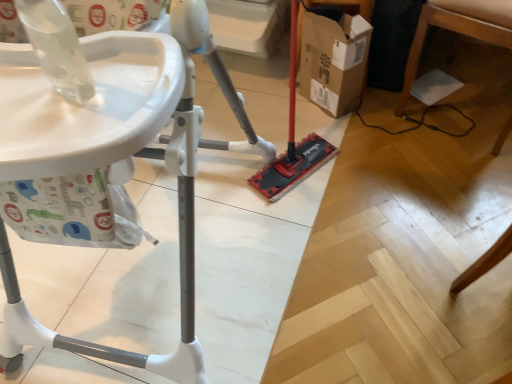
Where is `white plastic high chair at left, the second furniture positioned from the right`? white plastic high chair at left, the second furniture positioned from the right is located at coordinates (129, 167).

This screenshot has height=384, width=512. Identify the location of white plastic high chair at left, which appears as the 1th furniture when viewed from the left. (129, 167).

Could you measure the distance between white plastic high chair at left, the second furniture positioned from the right, and cardboard box at center?

white plastic high chair at left, the second furniture positioned from the right, is 27.99 inches away from cardboard box at center.

Between white plastic high chair at left, which appears as the 1th furniture when viewed from the left, and cardboard box at center, which one appears on the right side from the viewer's perspective?

cardboard box at center is more to the right.

From the image's perspective, between white plastic high chair at left, the second furniture positioned from the right, and cardboard box at center, which one is located above?

cardboard box at center is shown above in the image.

Are white plastic high chair at left, the second furniture positioned from the right, and cardboard box at center far apart?

white plastic high chair at left, the second furniture positioned from the right, is near cardboard box at center, not far away.

Where is `furniture that is the 2nd object located in front of the cardboard box at center`? This screenshot has height=384, width=512. furniture that is the 2nd object located in front of the cardboard box at center is located at coordinates (129, 167).

Can you tell me how much cardboard box at center and white plastic high chair at left, the second furniture positioned from the right, differ in facing direction?

They differ by 0.279 degrees in their facing directions.

Is cardboard box at center bigger than white plastic high chair at left, the second furniture positioned from the right?

Incorrect, cardboard box at center is not larger than white plastic high chair at left, the second furniture positioned from the right.

Is cardboard box at center closer to camera compared to white plastic high chair at left, which appears as the 1th furniture when viewed from the left?

No, cardboard box at center is further to the viewer.

Are wooden table leg at lower right, which is counted as the 2th furniture, starting from the left, and white plastic high chair at left, which appears as the 1th furniture when viewed from the left, located far from each other?

Indeed, wooden table leg at lower right, which is counted as the 2th furniture, starting from the left, is not near white plastic high chair at left, which appears as the 1th furniture when viewed from the left.

Is point (467, 16) closer to camera compared to point (24, 48)?

No, it is not.

Is wooden table leg at lower right, the 1th furniture positioned from the right, closer to the viewer compared to white plastic high chair at left, which appears as the 1th furniture when viewed from the left?

No, it is behind white plastic high chair at left, which appears as the 1th furniture when viewed from the left.

Consider the image. Which object is further away from the camera taking this photo, cardboard box at center or wooden table leg at lower right, which is counted as the 2th furniture, starting from the left?

Positioned behind is cardboard box at center.

Is cardboard box at center taller or shorter than wooden table leg at lower right, which is counted as the 2th furniture, starting from the left?

Considering their sizes, cardboard box at center has less height than wooden table leg at lower right, which is counted as the 2th furniture, starting from the left.

Is cardboard box at center facing away from wooden table leg at lower right, which is counted as the 2th furniture, starting from the left?

No, cardboard box at center is not facing away from wooden table leg at lower right, which is counted as the 2th furniture, starting from the left.

Identify the location of cardboard box located below the wooden table leg at lower right, the 1th furniture positioned from the right (from the image's perspective). Image resolution: width=512 pixels, height=384 pixels. (332, 59).

Is wooden table leg at lower right, which is counted as the 2th furniture, starting from the left, far from cardboard box at center?

No, there isn't a large distance between wooden table leg at lower right, which is counted as the 2th furniture, starting from the left, and cardboard box at center.

Considering the sizes of objects wooden table leg at lower right, which is counted as the 2th furniture, starting from the left, and cardboard box at center in the image provided, who is thinner, wooden table leg at lower right, which is counted as the 2th furniture, starting from the left, or cardboard box at center?

Thinner between the two is cardboard box at center.

Which object is positioned more to the right, wooden table leg at lower right, which is counted as the 2th furniture, starting from the left, or cardboard box at center?

wooden table leg at lower right, which is counted as the 2th furniture, starting from the left, is more to the right.

Looking at this image, is white plastic high chair at left, which appears as the 1th furniture when viewed from the left, surrounding wooden table leg at lower right, the 1th furniture positioned from the right?

No, wooden table leg at lower right, the 1th furniture positioned from the right, is located outside of white plastic high chair at left, which appears as the 1th furniture when viewed from the left.

Does white plastic high chair at left, the second furniture positioned from the right, have a larger size compared to wooden table leg at lower right, the 1th furniture positioned from the right?

Correct, white plastic high chair at left, the second furniture positioned from the right, is larger in size than wooden table leg at lower right, the 1th furniture positioned from the right.

From the image's perspective, would you say white plastic high chair at left, which appears as the 1th furniture when viewed from the left, is positioned over wooden table leg at lower right, which is counted as the 2th furniture, starting from the left?

No, from the image's perspective, white plastic high chair at left, which appears as the 1th furniture when viewed from the left, is not over wooden table leg at lower right, which is counted as the 2th furniture, starting from the left.

What's the angular difference between white plastic high chair at left, which appears as the 1th furniture when viewed from the left, and wooden table leg at lower right, which is counted as the 2th furniture, starting from the left,'s facing directions?

The angle between the facing direction of white plastic high chair at left, which appears as the 1th furniture when viewed from the left, and the facing direction of wooden table leg at lower right, which is counted as the 2th furniture, starting from the left, is 0.141 degrees.

Find the location of a particular element. cardboard box that appears below the white plastic high chair at left, the second furniture positioned from the right (from a real-world perspective) is located at coordinates (332, 59).

Find the location of a particular element. Image resolution: width=512 pixels, height=384 pixels. the 2nd furniture in front of the cardboard box at center is located at coordinates (129, 167).

When comparing their distances from cardboard box at center, does wooden table leg at lower right, which is counted as the 2th furniture, starting from the left, or white plastic high chair at left, the second furniture positioned from the right, seem closer?

Based on the image, wooden table leg at lower right, which is counted as the 2th furniture, starting from the left, appears to be nearer to cardboard box at center.

Estimate the real-world distances between objects in this image. Which object is further from white plastic high chair at left, the second furniture positioned from the right, wooden table leg at lower right, which is counted as the 2th furniture, starting from the left, or cardboard box at center?

wooden table leg at lower right, which is counted as the 2th furniture, starting from the left, lies further to white plastic high chair at left, the second furniture positioned from the right, than the other object.

Considering their positions, is white plastic high chair at left, which appears as the 1th furniture when viewed from the left, positioned closer to cardboard box at center than wooden table leg at lower right, the 1th furniture positioned from the right?

The object closer to cardboard box at center is wooden table leg at lower right, the 1th furniture positioned from the right.

From the image, which object appears to be farther from wooden table leg at lower right, the 1th furniture positioned from the right, cardboard box at center or white plastic high chair at left, the second furniture positioned from the right?

Based on the image, white plastic high chair at left, the second furniture positioned from the right, appears to be further to wooden table leg at lower right, the 1th furniture positioned from the right.

Looking at the image, which one is located further to white plastic high chair at left, the second furniture positioned from the right, cardboard box at center or wooden table leg at lower right, which is counted as the 2th furniture, starting from the left?

wooden table leg at lower right, which is counted as the 2th furniture, starting from the left, is positioned further to the anchor white plastic high chair at left, the second furniture positioned from the right.

Based on their spatial positions, is white plastic high chair at left, which appears as the 1th furniture when viewed from the left, or cardboard box at center closer to wooden table leg at lower right, the 1th furniture positioned from the right?

cardboard box at center is closer to wooden table leg at lower right, the 1th furniture positioned from the right.

Locate an element on the screen. This screenshot has width=512, height=384. furniture located between white plastic high chair at left, the second furniture positioned from the right, and cardboard box at center in the depth direction is located at coordinates (451, 30).